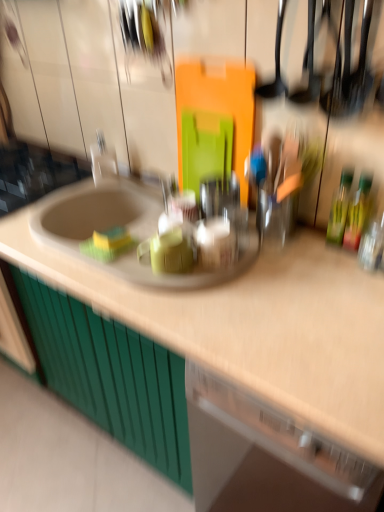
What is the approximate height of green glass bottle at right, which ranks as the 2th bottle in right-to-left order?

8.70 inches.

Locate an element on the screen. The image size is (384, 512). beige laminate countertop at center is located at coordinates (256, 327).

Is green glass bottle at right, which ranks as the 2th bottle in right-to-left order, positioned with its back to beige laminate countertop at center?

That's not correct — green glass bottle at right, which ranks as the 2th bottle in right-to-left order, is not looking away from beige laminate countertop at center.

Is green glass bottle at right, the 1th bottle when ordered from left to right, not close to beige laminate countertop at center?

Actually, green glass bottle at right, the 1th bottle when ordered from left to right, and beige laminate countertop at center are a little close together.

From the image's perspective, would you say green glass bottle at right, which ranks as the 2th bottle in right-to-left order, is positioned over beige laminate countertop at center?

Yes, from the image's perspective, green glass bottle at right, which ranks as the 2th bottle in right-to-left order, is over beige laminate countertop at center.

Which is correct: green glass bottle at right, which ranks as the 2th bottle in right-to-left order, is inside beige laminate countertop at center, or outside of it?

green glass bottle at right, which ranks as the 2th bottle in right-to-left order, cannot be found inside beige laminate countertop at center.

Does green glass bottle at right, arranged as the first bottle when viewed from the right, lie behind green glass bottle at right, which ranks as the 2th bottle in right-to-left order?

No, green glass bottle at right, arranged as the first bottle when viewed from the right, is closer to the camera.

Is green glass bottle at right, arranged as the first bottle when viewed from the right, shorter than green glass bottle at right, which ranks as the 2th bottle in right-to-left order?

Yes.

Is green glass bottle at right, arranged as the first bottle when viewed from the right, turned away from green glass bottle at right, the 1th bottle when ordered from left to right?

green glass bottle at right, arranged as the first bottle when viewed from the right, is not turned away from green glass bottle at right, the 1th bottle when ordered from left to right.

Does green glass bottle at right, arranged as the first bottle when viewed from the right, have a lesser height compared to beige laminate countertop at center?

Indeed, green glass bottle at right, arranged as the first bottle when viewed from the right, has a lesser height compared to beige laminate countertop at center.

Considering the sizes of green glass bottle at right, arranged as the first bottle when viewed from the right, and beige laminate countertop at center in the image, is green glass bottle at right, arranged as the first bottle when viewed from the right, bigger or smaller than beige laminate countertop at center?

green glass bottle at right, arranged as the first bottle when viewed from the right, is smaller than beige laminate countertop at center.

Is green glass bottle at right, marked as the second bottle in a left-to-right arrangement, with beige laminate countertop at center?

No, green glass bottle at right, marked as the second bottle in a left-to-right arrangement, is not in contact with beige laminate countertop at center.

Choose the correct answer: Is green glass bottle at right, arranged as the first bottle when viewed from the right, inside beige laminate countertop at center or outside it?

green glass bottle at right, arranged as the first bottle when viewed from the right, is not inside beige laminate countertop at center, it's outside.

Consider the image. In the image, is beige laminate countertop at center positioned in front of or behind green matte cabinet at lower left?

beige laminate countertop at center is positioned closer to the viewer than green matte cabinet at lower left.

Is beige laminate countertop at center not inside green matte cabinet at lower left?

Yes, beige laminate countertop at center is located beyond the bounds of green matte cabinet at lower left.

Which is behind, point (264, 265) or point (80, 355)?

Positioned behind is point (80, 355).

Is green matte cabinet at lower left facing away from green glass bottle at right, marked as the second bottle in a left-to-right arrangement?

No, green matte cabinet at lower left is not facing away from green glass bottle at right, marked as the second bottle in a left-to-right arrangement.

From the image's perspective, relative to green glass bottle at right, arranged as the first bottle when viewed from the right, is green matte cabinet at lower left above or below?

green matte cabinet at lower left is situated lower than green glass bottle at right, arranged as the first bottle when viewed from the right, in the image.

Considering the relative sizes of green matte cabinet at lower left and green glass bottle at right, arranged as the first bottle when viewed from the right, in the image provided, is green matte cabinet at lower left thinner than green glass bottle at right, arranged as the first bottle when viewed from the right,?

No, green matte cabinet at lower left is not thinner than green glass bottle at right, arranged as the first bottle when viewed from the right.

How distant is green matte cabinet at lower left from green glass bottle at right, arranged as the first bottle when viewed from the right?

green matte cabinet at lower left is 35.40 inches from green glass bottle at right, arranged as the first bottle when viewed from the right.

Is green matte cabinet at lower left looking in the opposite direction of beige laminate countertop at center?

No.

Between green matte cabinet at lower left and beige laminate countertop at center, which one has more height?

beige laminate countertop at center.

How many degrees apart are the facing directions of green matte cabinet at lower left and beige laminate countertop at center?

1.32 degrees.

Considering the sizes of objects green matte cabinet at lower left and beige laminate countertop at center in the image provided, who is wider, green matte cabinet at lower left or beige laminate countertop at center?

beige laminate countertop at center.

Is white glossy faucet at upper left shorter than beige laminate countertop at center?

Yes.

Between white glossy faucet at upper left and beige laminate countertop at center, which one has larger size?

Bigger between the two is beige laminate countertop at center.

Which object is further away from the camera, white glossy faucet at upper left or beige laminate countertop at center?

Positioned behind is white glossy faucet at upper left.

Locate an element on the screen. The image size is (384, 512). countertop beneath the green glass bottle at right, which ranks as the 2th bottle in right-to-left order (from a real-world perspective) is located at coordinates (256, 327).

I want to click on bottle that appears in front of the green glass bottle at right, the 1th bottle when ordered from left to right, so pyautogui.click(x=357, y=213).

Looking at the image, which one is located further to green glass bottle at right, which ranks as the 2th bottle in right-to-left order, beige laminate countertop at center or green matte cabinet at lower left?

green matte cabinet at lower left is positioned further to the anchor green glass bottle at right, which ranks as the 2th bottle in right-to-left order.

From the image, which object appears to be farther from green glass bottle at right, the 1th bottle when ordered from left to right, white glossy faucet at upper left or green glass bottle at right, marked as the second bottle in a left-to-right arrangement?

white glossy faucet at upper left is further to green glass bottle at right, the 1th bottle when ordered from left to right.

Estimate the real-world distances between objects in this image. Which object is further from white glossy faucet at upper left, beige laminate countertop at center or green glass bottle at right, which ranks as the 2th bottle in right-to-left order?

Based on the image, green glass bottle at right, which ranks as the 2th bottle in right-to-left order, appears to be further to white glossy faucet at upper left.

Based on their spatial positions, is green glass bottle at right, which ranks as the 2th bottle in right-to-left order, or white glossy faucet at upper left further from green glass bottle at right, marked as the second bottle in a left-to-right arrangement?

white glossy faucet at upper left.

Based on their spatial positions, is green glass bottle at right, arranged as the first bottle when viewed from the right, or green matte cabinet at lower left further from white glossy faucet at upper left?

Based on the image, green glass bottle at right, arranged as the first bottle when viewed from the right, appears to be further to white glossy faucet at upper left.

From the image, which object appears to be farther from beige laminate countertop at center, green glass bottle at right, marked as the second bottle in a left-to-right arrangement, or green glass bottle at right, the 1th bottle when ordered from left to right?

Based on the image, green glass bottle at right, marked as the second bottle in a left-to-right arrangement, appears to be further to beige laminate countertop at center.

Based on their spatial positions, is green matte cabinet at lower left or green glass bottle at right, which ranks as the 2th bottle in right-to-left order, closer to green glass bottle at right, arranged as the first bottle when viewed from the right?

green glass bottle at right, which ranks as the 2th bottle in right-to-left order, is positioned closer to the anchor green glass bottle at right, arranged as the first bottle when viewed from the right.

Considering their positions, is green glass bottle at right, which ranks as the 2th bottle in right-to-left order, positioned further to beige laminate countertop at center than white glossy faucet at upper left?

white glossy faucet at upper left lies further to beige laminate countertop at center than the other object.

Locate an element on the screen. The image size is (384, 512). bottle between beige laminate countertop at center and green glass bottle at right, marked as the second bottle in a left-to-right arrangement, in the horizontal direction is located at coordinates (339, 208).

Locate an element on the screen. This screenshot has width=384, height=512. faucet located between beige laminate countertop at center and green glass bottle at right, arranged as the first bottle when viewed from the right, in the left-right direction is located at coordinates (103, 160).

Find the location of a particular element. countertop between white glossy faucet at upper left and green matte cabinet at lower left in the up-down direction is located at coordinates (256, 327).

The height and width of the screenshot is (512, 384). Identify the location of bottle between green matte cabinet at lower left and green glass bottle at right, marked as the second bottle in a left-to-right arrangement, in the horizontal direction. pos(339,208).